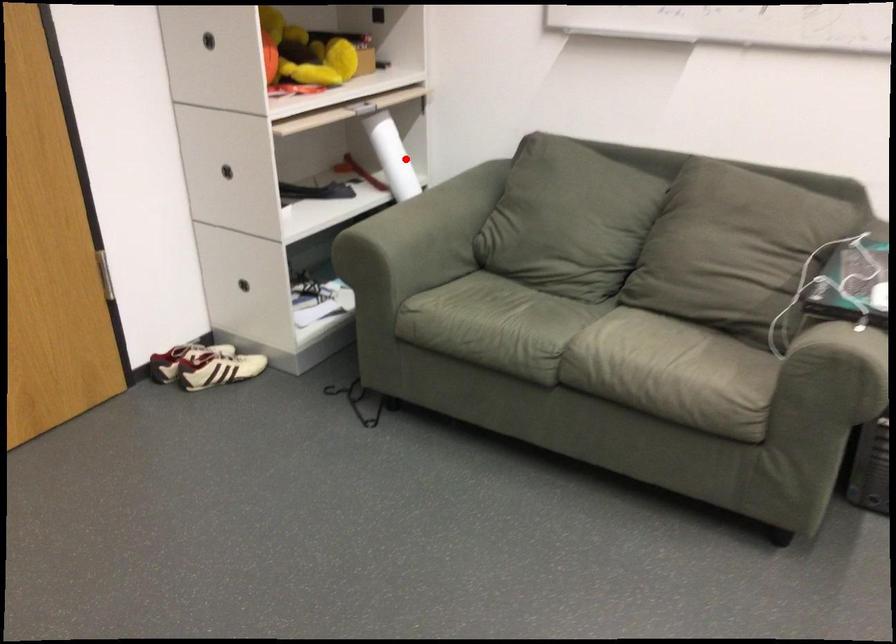
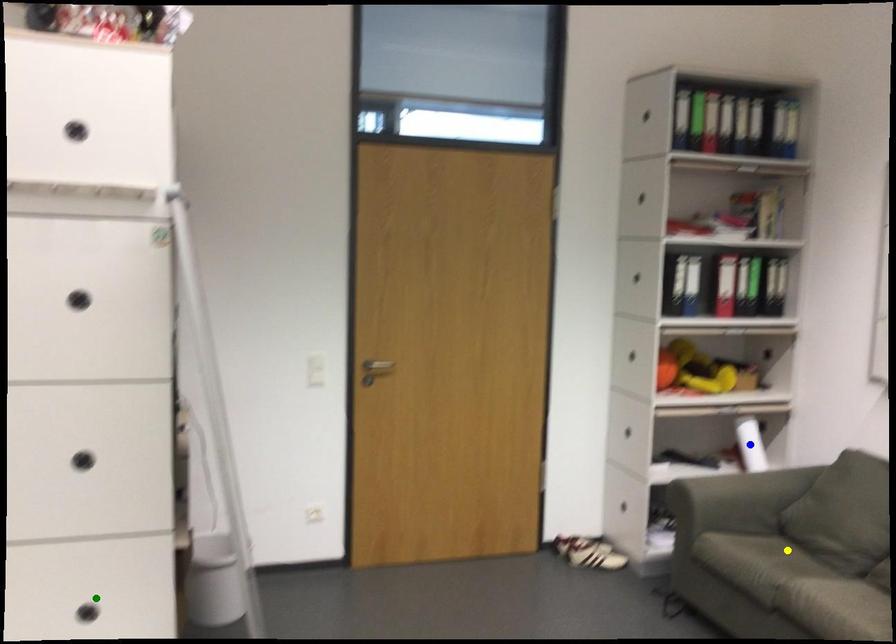
Question: I am providing you with two images of the same scene from different viewpoints. A red point is marked on the first image. You are given multiple points on the second image. Which mark in image 2 goes with the point in image 1?

Choices:
 (A) yellow point
 (B) green point
 (C) blue point

Answer: (C)